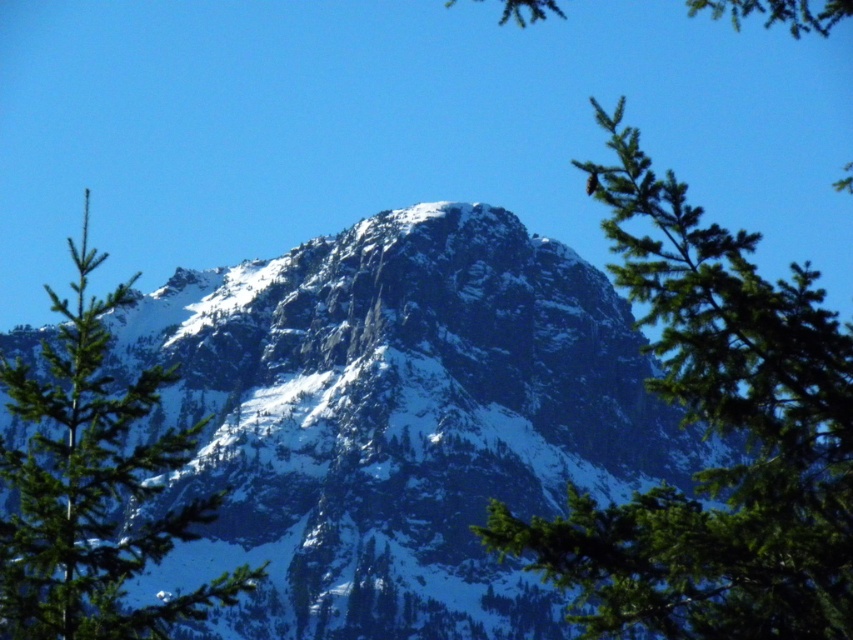
You are a hiker standing at the base of the mountain and looking at the point marked as point (717,432). What is the closest object to this point?

The point (717,432) is on green needle like branches at center, so the closest object to this point is the green needle like branches at center.